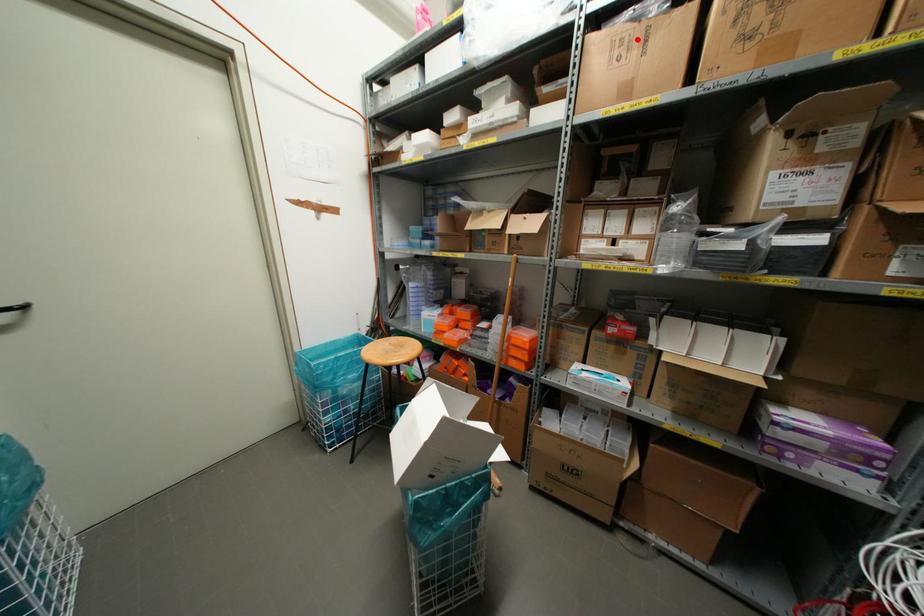
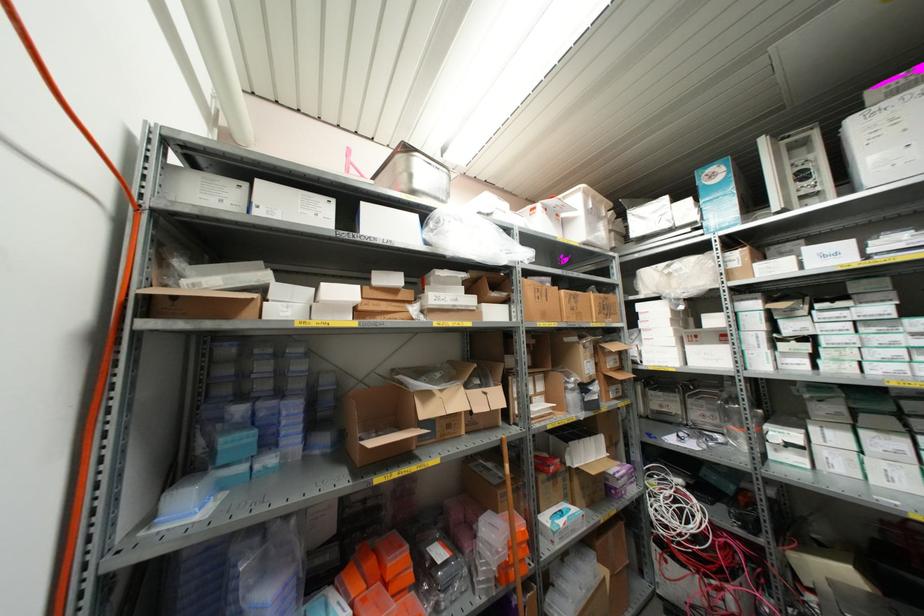
Find the pixel in the second image that matches the highlighted location in the first image.

(542, 292)